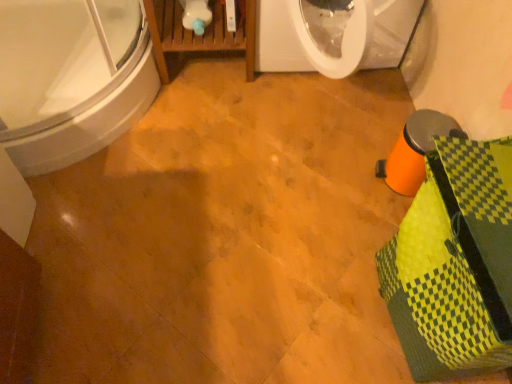
Question: Based on their sizes in the image, would you say yellow-green woven basket at lower right is bigger or smaller than white glossy bathtub at upper left?

Choices:
 (A) big
 (B) small

Answer: (B)

Question: In the image, is yellow-green woven basket at lower right on the left side or the right side of white glossy bathtub at upper left?

Choices:
 (A) left
 (B) right

Answer: (B)

Question: Considering their positions, is yellow-green woven basket at lower right located in front of or behind white glossy bathtub at upper left?

Choices:
 (A) front
 (B) behind

Answer: (A)

Question: From the image's perspective, is white glossy bathtub at upper left above or below yellow-green woven basket at lower right?

Choices:
 (A) below
 (B) above

Answer: (B)

Question: Considering the positions of white glossy bathtub at upper left and yellow-green woven basket at lower right in the image, is white glossy bathtub at upper left taller or shorter than yellow-green woven basket at lower right?

Choices:
 (A) tall
 (B) short

Answer: (B)

Question: Does point (41, 92) appear closer or farther from the camera than point (478, 187)?

Choices:
 (A) farther
 (B) closer

Answer: (A)

Question: In terms of size, does white glossy bathtub at upper left appear bigger or smaller than yellow-green woven basket at lower right?

Choices:
 (A) big
 (B) small

Answer: (A)